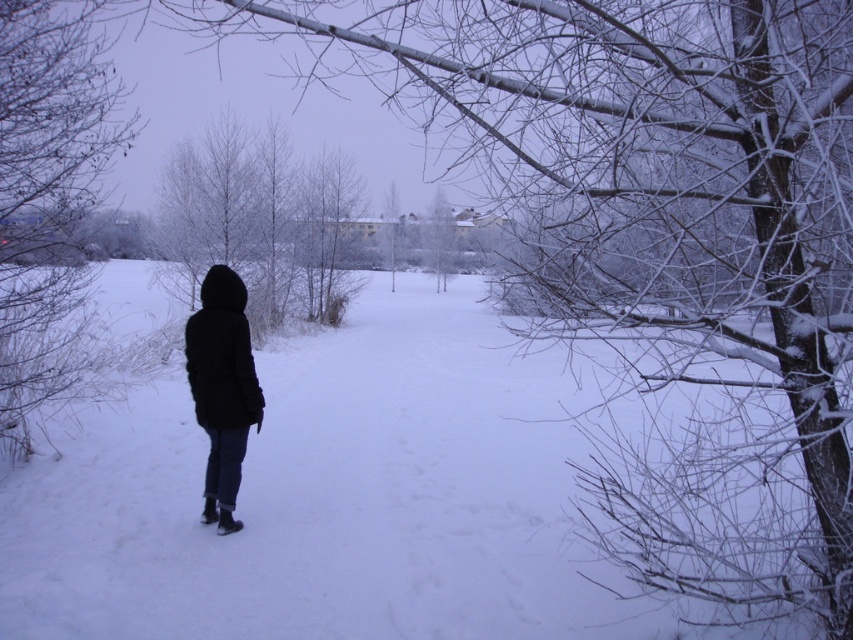
You are a photographer trying to capture the white frosty branches at left and the black matte coat at center in a single frame. Based on their positions, which object should you adjust your camera angle to focus on first if you want to include both in your shot?

Since the white frosty branches at left are to the left of the black matte coat at center, you should first focus on the black matte coat at center to ensure it stays centered while adjusting the angle to include the branches on the left side.

You are a photographer trying to capture the winter scene. You notice the white frosty branches at left and the black matte coat at center. Which object would appear smaller in your photo?

The white frosty branches at left would appear smaller in the photo because they have a smaller size compared to the black matte coat at center.